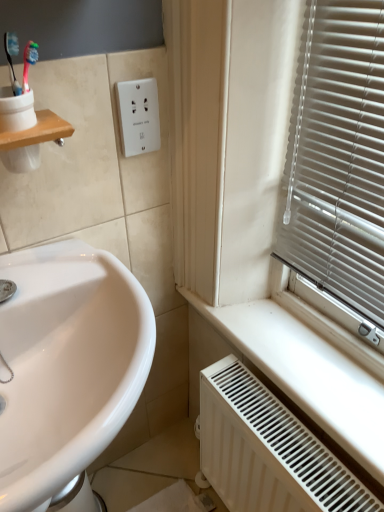
Question: Is white matte radiator at lower right at the right side of white plastic outlet at upper center?

Choices:
 (A) no
 (B) yes

Answer: (B)

Question: Is white matte radiator at lower right oriented away from white plastic outlet at upper center?

Choices:
 (A) no
 (B) yes

Answer: (A)

Question: Can you confirm if white matte radiator at lower right is positioned to the left of white plastic outlet at upper center?

Choices:
 (A) no
 (B) yes

Answer: (A)

Question: Considering the relative sizes of white matte radiator at lower right and white plastic outlet at upper center in the image provided, is white matte radiator at lower right bigger than white plastic outlet at upper center?

Choices:
 (A) yes
 (B) no

Answer: (A)

Question: Considering the relative sizes of white matte radiator at lower right and white plastic outlet at upper center in the image provided, is white matte radiator at lower right smaller than white plastic outlet at upper center?

Choices:
 (A) yes
 (B) no

Answer: (B)

Question: Considering the positions of point (76, 396) and point (0, 134), is point (76, 396) closer or farther from the camera than point (0, 134)?

Choices:
 (A) closer
 (B) farther

Answer: (B)

Question: Visually, is white glossy sink at lower left positioned to the left or to the right of wooden shelf at upper left?

Choices:
 (A) right
 (B) left

Answer: (A)

Question: Is white glossy sink at lower left wider or thinner than wooden shelf at upper left?

Choices:
 (A) wide
 (B) thin

Answer: (A)

Question: From the image's perspective, is white glossy sink at lower left located above or below wooden shelf at upper left?

Choices:
 (A) below
 (B) above

Answer: (A)

Question: From a real-world perspective, is white plastic outlet at upper center positioned above or below white matte radiator at lower right?

Choices:
 (A) below
 (B) above

Answer: (B)

Question: Looking at the image, does white plastic outlet at upper center seem bigger or smaller compared to white matte radiator at lower right?

Choices:
 (A) small
 (B) big

Answer: (A)

Question: Considering the positions of white plastic outlet at upper center and white matte radiator at lower right in the image, is white plastic outlet at upper center wider or thinner than white matte radiator at lower right?

Choices:
 (A) thin
 (B) wide

Answer: (A)

Question: Which is correct: white plastic outlet at upper center is inside white matte radiator at lower right, or outside of it?

Choices:
 (A) inside
 (B) outside

Answer: (B)

Question: In the image, is white plastic outlet at upper center positioned in front of or behind white glossy sink at lower left?

Choices:
 (A) behind
 (B) front

Answer: (A)

Question: From the image's perspective, is white plastic outlet at upper center above or below white glossy sink at lower left?

Choices:
 (A) below
 (B) above

Answer: (B)